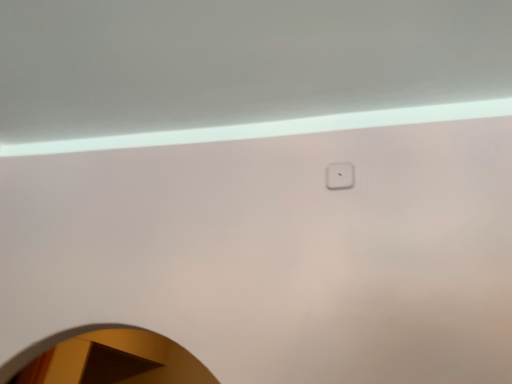
In order to face white plastic light switch at upper center, should I rotate leftwards or rightwards?

It's best to rotate right around 11.960 degrees.

Describe the element at coordinates (340, 176) in the screenshot. The image size is (512, 384). I see `white plastic light switch at upper center` at that location.

What are the coordinates of `white plastic light switch at upper center` in the screenshot? It's located at (340, 176).

You are a GUI agent. You are given a task and a screenshot of the screen. Output one action in this format:
    pyautogui.click(x=<x>, y=<y>)
    Task: Click on the white glossy mirror at lower left
    
    Given the screenshot: What is the action you would take?
    point(106,358)

Describe the element at coordinates (106, 358) in the screenshot. I see `white glossy mirror at lower left` at that location.

At what (x,y) coordinates should I click in order to perform the action: click on white plastic light switch at upper center. Please return your answer as a coordinate pair (x, y). This screenshot has height=384, width=512. Looking at the image, I should click on (340, 176).

Based on the photo, considering the positions of objects white glossy mirror at lower left and white plastic light switch at upper center in the image provided, who is more to the left, white glossy mirror at lower left or white plastic light switch at upper center?

white glossy mirror at lower left.

Considering their positions, is white glossy mirror at lower left located in front of or behind white plastic light switch at upper center?

white glossy mirror at lower left is in front of white plastic light switch at upper center.

Considering the positions of point (102, 369) and point (338, 170), is point (102, 369) closer or farther from the camera than point (338, 170)?

Point (102, 369) is farther from the camera than point (338, 170).

From the image's perspective, is white glossy mirror at lower left above white plastic light switch at upper center?

No, from the image's perspective, white glossy mirror at lower left is not on top of white plastic light switch at upper center.

Looking at this image, from a real-world perspective, which object rests below the other?

From a 3D spatial view, white glossy mirror at lower left is below.

In the scene shown: Looking at their sizes, would you say white glossy mirror at lower left is wider or thinner than white plastic light switch at upper center?

Considering their sizes, white glossy mirror at lower left looks broader than white plastic light switch at upper center.

Does white glossy mirror at lower left have a greater height compared to white plastic light switch at upper center?

Correct, white glossy mirror at lower left is much taller as white plastic light switch at upper center.

Between white glossy mirror at lower left and white plastic light switch at upper center, which one has larger size?

white glossy mirror at lower left is bigger.

Based on the photo, is white plastic light switch at upper center located within white glossy mirror at lower left?

No, white plastic light switch at upper center is not surrounded by white glossy mirror at lower left.

Would you consider white glossy mirror at lower left to be distant from white plastic light switch at upper center?

Absolutely, white glossy mirror at lower left is distant from white plastic light switch at upper center.

Does white glossy mirror at lower left turn towards white plastic light switch at upper center?

→ No.

Identify the location of light switch on the right of white glossy mirror at lower left. (340, 176).

Does white plastic light switch at upper center appear on the left side of white glossy mirror at lower left?

Incorrect, white plastic light switch at upper center is not on the left side of white glossy mirror at lower left.

In the image, is white plastic light switch at upper center positioned in front of or behind white glossy mirror at lower left?

Clearly, white plastic light switch at upper center is behind white glossy mirror at lower left.

Is point (331, 189) farther from viewer compared to point (74, 365)?

That is False.

From the image's perspective, which object appears higher, white plastic light switch at upper center or white glossy mirror at lower left?

white plastic light switch at upper center is shown above in the image.

From a real-world perspective, between white plastic light switch at upper center and white glossy mirror at lower left, who is vertically lower?

In real-world perspective, white glossy mirror at lower left is lower.

Is white plastic light switch at upper center thinner than white glossy mirror at lower left?

Indeed, white plastic light switch at upper center has a lesser width compared to white glossy mirror at lower left.

Which of these two, white plastic light switch at upper center or white glossy mirror at lower left, stands shorter?

white plastic light switch at upper center is shorter.

In terms of size, does white plastic light switch at upper center appear bigger or smaller than white glossy mirror at lower left?

Considering their sizes, white plastic light switch at upper center takes up less space than white glossy mirror at lower left.

Is white plastic light switch at upper center inside the boundaries of white glossy mirror at lower left, or outside?

white plastic light switch at upper center cannot be found inside white glossy mirror at lower left.

Is white plastic light switch at upper center not near white glossy mirror at lower left?

white plastic light switch at upper center is positioned a significant distance from white glossy mirror at lower left.

Does white plastic light switch at upper center turn towards white glossy mirror at lower left?

No, white plastic light switch at upper center is not oriented towards white glossy mirror at lower left.

How many degrees apart are the facing directions of white plastic light switch at upper center and white glossy mirror at lower left?

The angle between the facing direction of white plastic light switch at upper center and the facing direction of white glossy mirror at lower left is 2.69 degrees.

Locate an element on the screen. light switch that is above the white glossy mirror at lower left (from a real-world perspective) is located at coordinates (340, 176).

Locate an element on the screen. The image size is (512, 384). mirror below the white plastic light switch at upper center (from the image's perspective) is located at coordinates (106, 358).

I want to click on light switch above the white glossy mirror at lower left (from the image's perspective), so click(x=340, y=176).